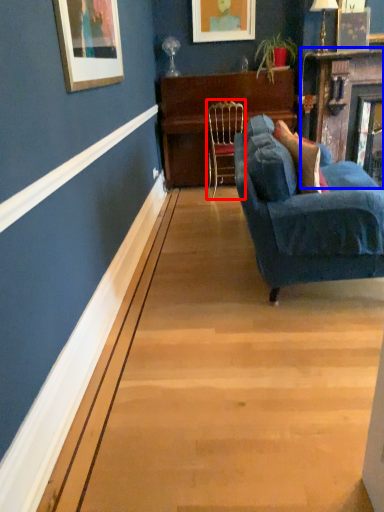
Question: Which point is further to the camera, chair (highlighted by a red box) or fireplace (highlighted by a blue box)?

Choices:
 (A) chair
 (B) fireplace

Answer: (A)